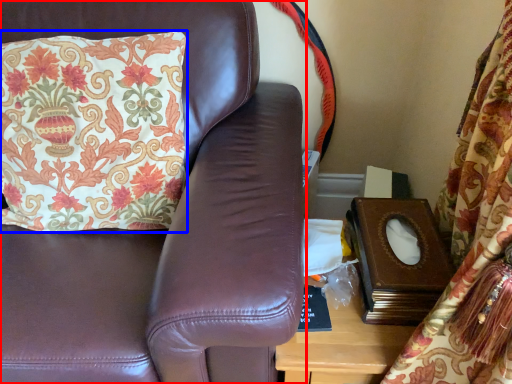
Question: Among these objects, which one is farthest to the camera, furniture (highlighted by a red box) or pillow (highlighted by a blue box)?

Choices:
 (A) furniture
 (B) pillow

Answer: (B)